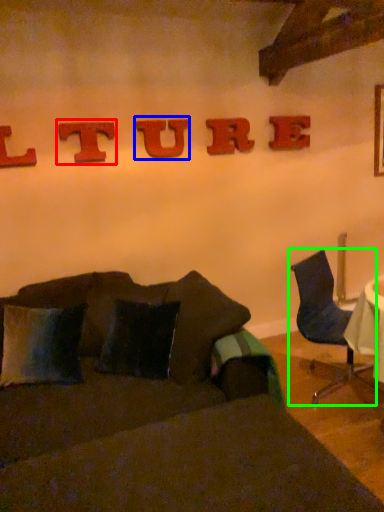
Question: Considering the real-world distances, which object is farthest from alphabet (highlighted by a red box)? alphabet (highlighted by a blue box) or chair (highlighted by a green box)?

Choices:
 (A) alphabet
 (B) chair

Answer: (B)